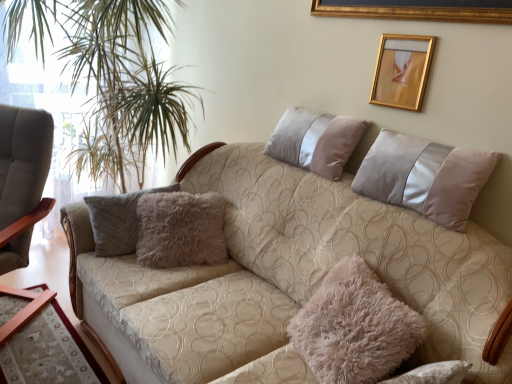
Question: Do you think beige fabric couch at center is within gold metallic picture frame at upper right, or outside of it?

Choices:
 (A) outside
 (B) inside

Answer: (A)

Question: Is beige fabric couch at center taller or shorter than gold metallic picture frame at upper right?

Choices:
 (A) tall
 (B) short

Answer: (A)

Question: Estimate the real-world distances between objects in this image. Which object is closer to the gold metallic picture frame at upper right?

Choices:
 (A) matte gray armchair at left
 (B) green leafy plant at left
 (C) silky beige pillow at upper right, the 2th pillow in the bottom-to-top sequence
 (D) fuzzy beige pillow at center, the 2th pillow from the top
 (E) beige fabric couch at center

Answer: (C)

Question: Estimate the real-world distances between objects in this image. Which object is closer to the matte gray armchair at left?

Choices:
 (A) silky beige pillow at upper right, the 2th pillow in the bottom-to-top sequence
 (B) green leafy plant at left
 (C) gold metallic picture frame at upper right
 (D) fuzzy beige pillow at center, the 2th pillow from the top
 (E) beige fabric couch at center

Answer: (B)